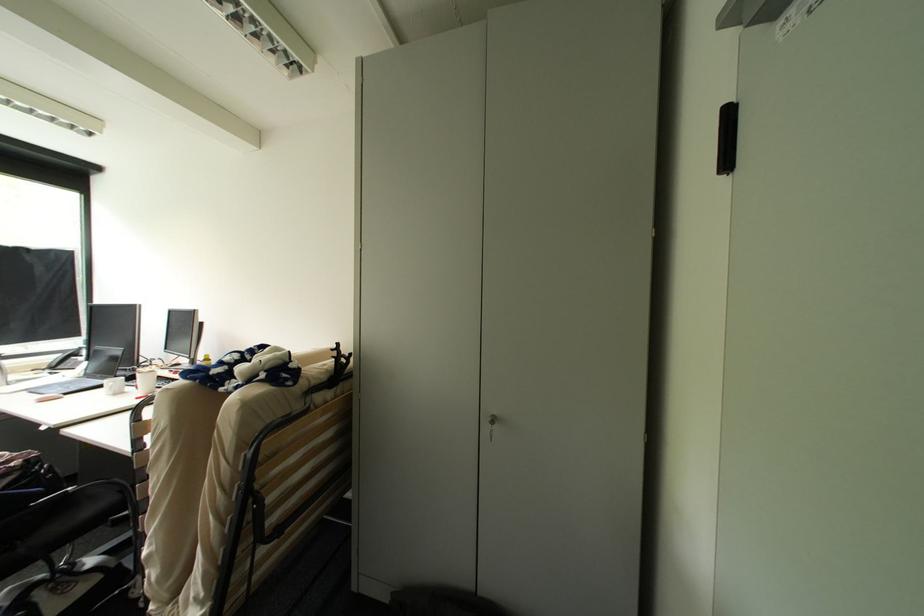
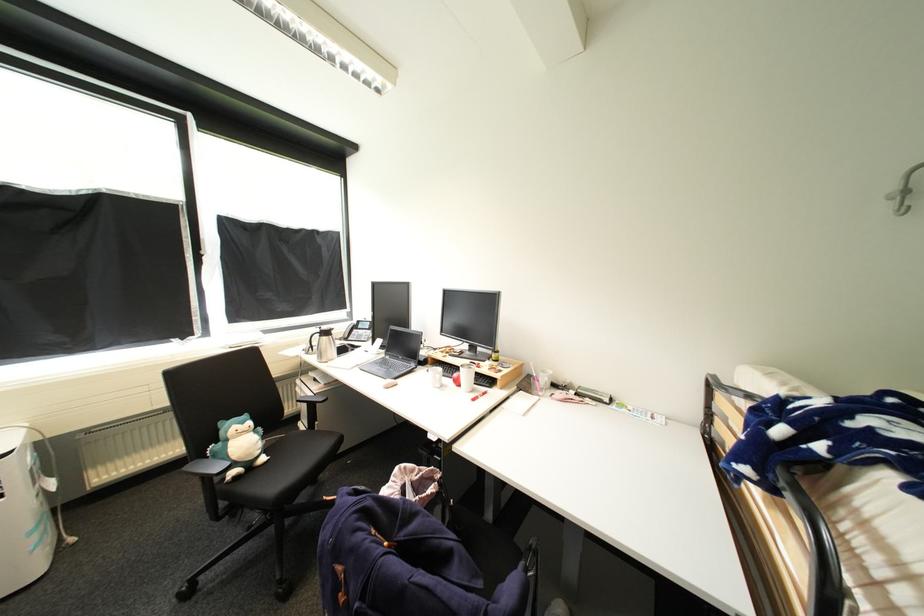
Locate, in the second image, the point that corresponds to point (35, 390) in the first image.

(363, 366)